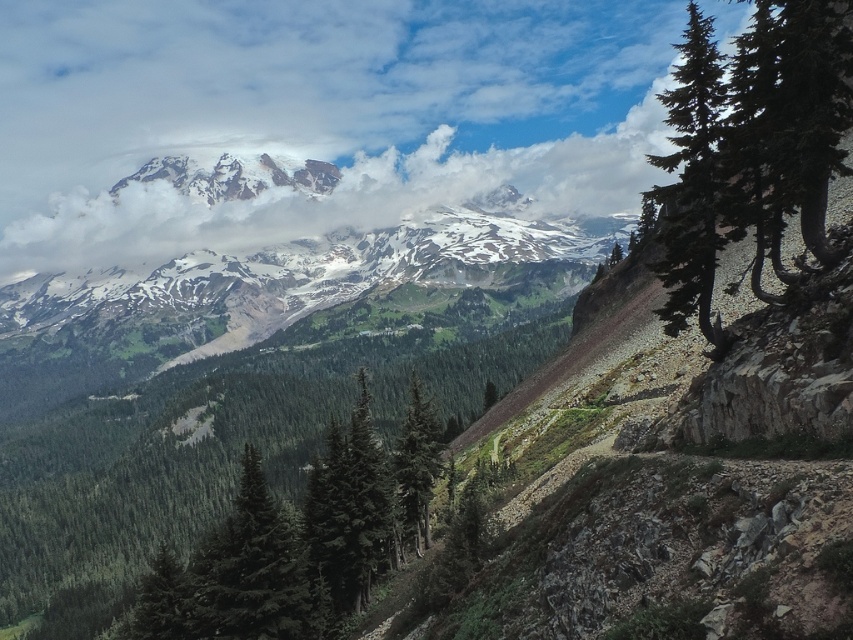
You are a hiker planning to take a photo of the snowy rocky mountain range at upper center. To ensure the mountain is centered in your shot, should you adjust your camera position to the left or right of the current viewpoint?

The snowy rocky mountain range at upper center is already positioned at the center coordinates of the image, so no adjustment is needed. Keep your camera at the current viewpoint to center the mountain in your photo.

You are planning to hang a swing between the green rough bark tree at upper right and the green matte tree at center. Which tree has a thicker trunk to support the swing?

The green rough bark tree at upper right might be wider than the green matte tree at center, so it could have a thicker trunk to support the swing.

You are a hiker planning to take a photo of the snowy rocky mountain range at upper center and the green rough bark tree at upper right from a spot near the valley floor. Which object should you position closer to the left side of your camera frame?

The snowy rocky mountain range at upper center should be positioned closer to the left side of your camera frame because it is located on the left side of the green rough bark tree at upper right.